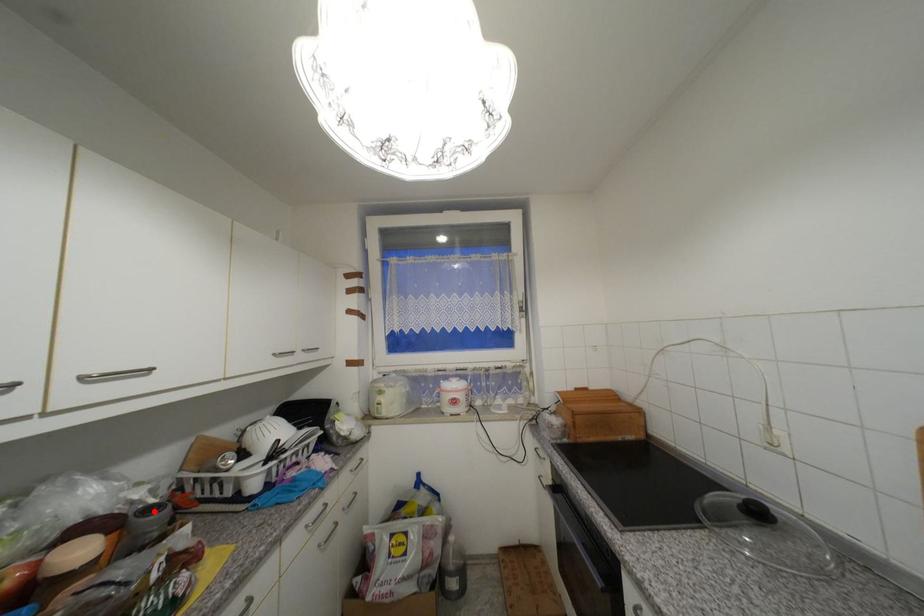
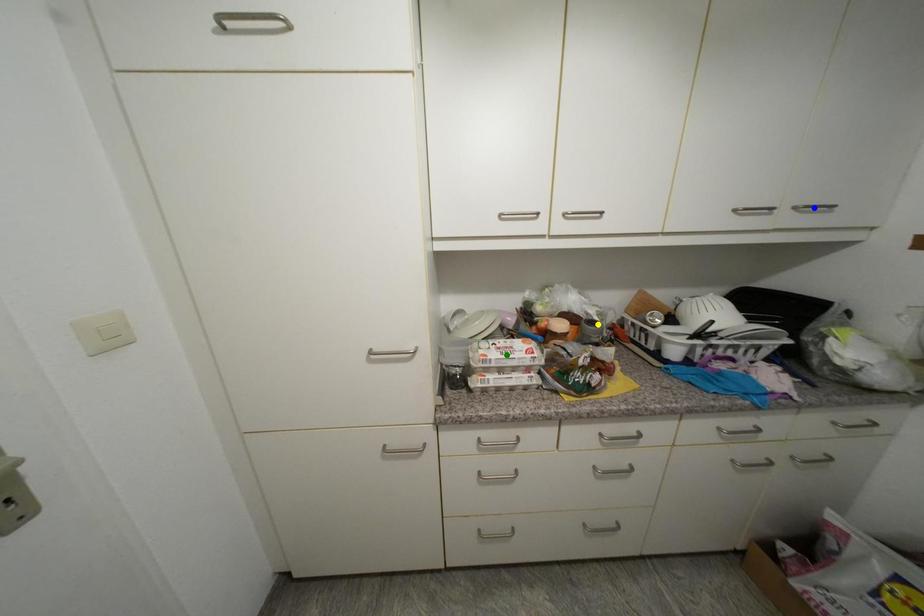
Question: I am providing you with two images of the same scene from different viewpoints. A red point is marked on the first image. You are given multiple points on the second image. Can you choose the point in image 2 that corresponds to the point in image 1?

Choices:
 (A) green point
 (B) blue point
 (C) yellow point

Answer: (C)